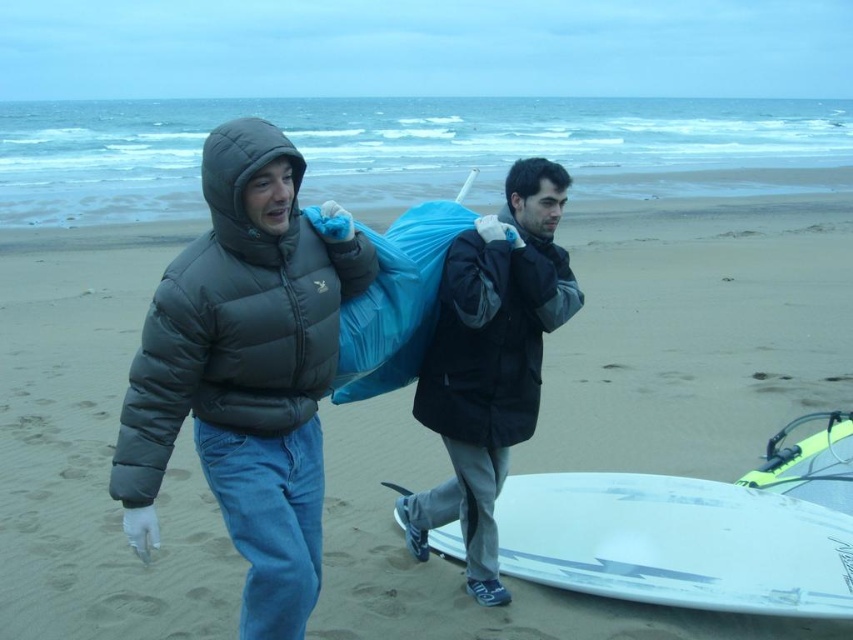
Question: Among these points, which one is farthest from the camera?

Choices:
 (A) (527, 426)
 (B) (744, 609)

Answer: (A)

Question: Considering the real-world distances, which object is closest to the dark gray matte jacket at center?

Choices:
 (A) dark gray puffer jacket at center
 (B) white glossy surfboard at lower center

Answer: (A)

Question: Is dark gray puffer jacket at center positioned before dark gray matte jacket at center?

Choices:
 (A) no
 (B) yes

Answer: (B)

Question: Does white glossy surfboard at lower center come behind dark gray matte jacket at center?

Choices:
 (A) yes
 (B) no

Answer: (B)

Question: Which point is farther to the camera?

Choices:
 (A) (521, 436)
 (B) (473, 460)
 (C) (641, 483)

Answer: (C)

Question: Does dark gray puffer jacket at center appear on the left side of dark gray matte jacket at center?

Choices:
 (A) yes
 (B) no

Answer: (A)